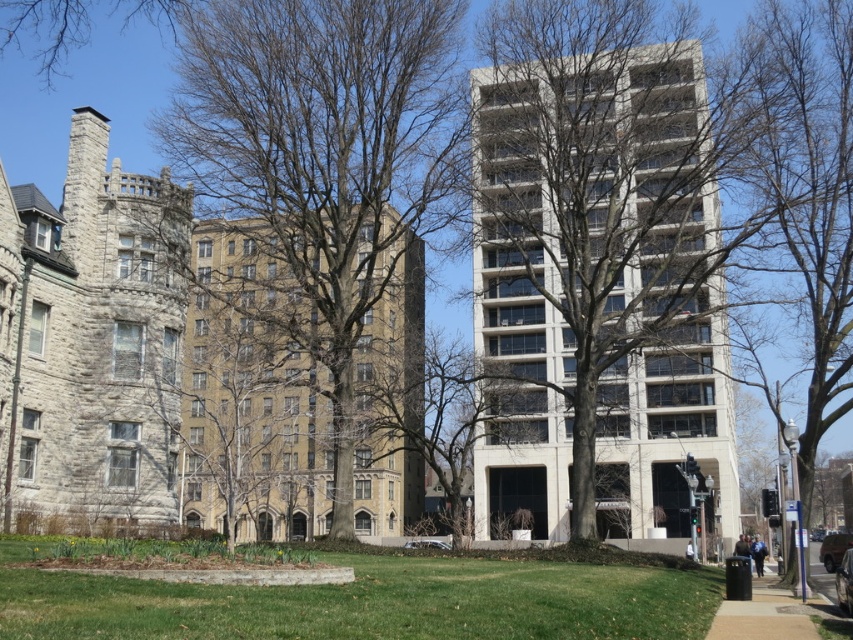
Question: From the image, what is the correct spatial relationship of gray stone tower at left in relation to brown stone building at center?

Choices:
 (A) right
 (B) left

Answer: (B)

Question: Does gray stone tower at left have a greater width compared to brown stone building at center?

Choices:
 (A) yes
 (B) no

Answer: (B)

Question: Estimate the real-world distances between objects in this image. Which object is farther from the gray stone chimney at upper left?

Choices:
 (A) bare branches at right
 (B) smooth brown tree at center

Answer: (A)

Question: Which point is closer to the camera?

Choices:
 (A) (303, 323)
 (B) (509, 193)
 (C) (93, 164)

Answer: (A)

Question: Which of the following is the closest to the observer?

Choices:
 (A) (373, 465)
 (B) (91, 205)
 (C) (730, 625)

Answer: (C)

Question: Observing the image, what is the correct spatial positioning of bare branches at center in reference to black asphalt sidewalk at lower right?

Choices:
 (A) left
 (B) right

Answer: (A)